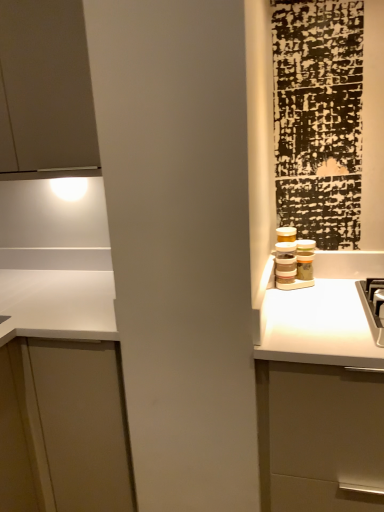
Question: From the image's perspective, would you say white matte cabinet at left, positioned as the first cabinetry in bottom-to-top order, is shown under matte white cabinet at upper left, the first cabinetry positioned from the top?

Choices:
 (A) no
 (B) yes

Answer: (B)

Question: Considering the relative sizes of white matte cabinet at left, positioned as the first cabinetry in bottom-to-top order, and matte white cabinet at upper left, the 2th cabinetry positioned from the bottom, in the image provided, is white matte cabinet at left, positioned as the first cabinetry in bottom-to-top order, smaller than matte white cabinet at upper left, the 2th cabinetry positioned from the bottom,?

Choices:
 (A) yes
 (B) no

Answer: (B)

Question: Is white matte cabinet at left, marked as the second cabinetry in a top-to-bottom arrangement, far from matte white cabinet at upper left, the first cabinetry positioned from the top?

Choices:
 (A) no
 (B) yes

Answer: (A)

Question: From a real-world perspective, is white matte cabinet at left, positioned as the first cabinetry in bottom-to-top order, located beneath matte white cabinet at upper left, the 2th cabinetry positioned from the bottom?

Choices:
 (A) no
 (B) yes

Answer: (B)

Question: Is white matte cabinet at left, marked as the second cabinetry in a top-to-bottom arrangement, outside of matte white cabinet at upper left, the 2th cabinetry positioned from the bottom?

Choices:
 (A) no
 (B) yes

Answer: (B)

Question: Does white matte cabinet at left, positioned as the first cabinetry in bottom-to-top order, have a greater width compared to matte white cabinet at upper left, the first cabinetry positioned from the top?

Choices:
 (A) yes
 (B) no

Answer: (A)

Question: Does matte white cabinet at upper left, the first cabinetry positioned from the top, have a greater height compared to white matte cabinet at left, positioned as the first cabinetry in bottom-to-top order?

Choices:
 (A) no
 (B) yes

Answer: (A)

Question: Considering the relative sizes of matte white cabinet at upper left, the first cabinetry positioned from the top, and white matte cabinet at left, positioned as the first cabinetry in bottom-to-top order, in the image provided, is matte white cabinet at upper left, the first cabinetry positioned from the top, thinner than white matte cabinet at left, positioned as the first cabinetry in bottom-to-top order,?

Choices:
 (A) no
 (B) yes

Answer: (B)

Question: Is white matte cabinet at left, positioned as the first cabinetry in bottom-to-top order, inside matte white cabinet at upper left, the 2th cabinetry positioned from the bottom?

Choices:
 (A) yes
 (B) no

Answer: (B)

Question: From a real-world perspective, is matte white cabinet at upper left, the first cabinetry positioned from the top, beneath white matte cabinet at left, marked as the second cabinetry in a top-to-bottom arrangement?

Choices:
 (A) yes
 (B) no

Answer: (B)

Question: Is matte white cabinet at upper left, the 2th cabinetry positioned from the bottom, wider than white matte cabinet at left, marked as the second cabinetry in a top-to-bottom arrangement?

Choices:
 (A) yes
 (B) no

Answer: (B)

Question: Is matte white cabinet at upper left, the first cabinetry positioned from the top, far away from white matte cabinet at left, marked as the second cabinetry in a top-to-bottom arrangement?

Choices:
 (A) no
 (B) yes

Answer: (A)

Question: Do you think matte white cabinet at upper left, the 2th cabinetry positioned from the bottom, is within white matte cabinet at left, positioned as the first cabinetry in bottom-to-top order, or outside of it?

Choices:
 (A) outside
 (B) inside

Answer: (A)